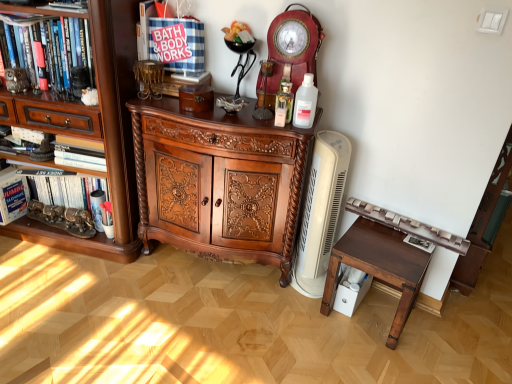
Image resolution: width=512 pixels, height=384 pixels. I want to click on vacant space underneath dark brown wooden table at right (from a real-world perspective), so [x=374, y=311].